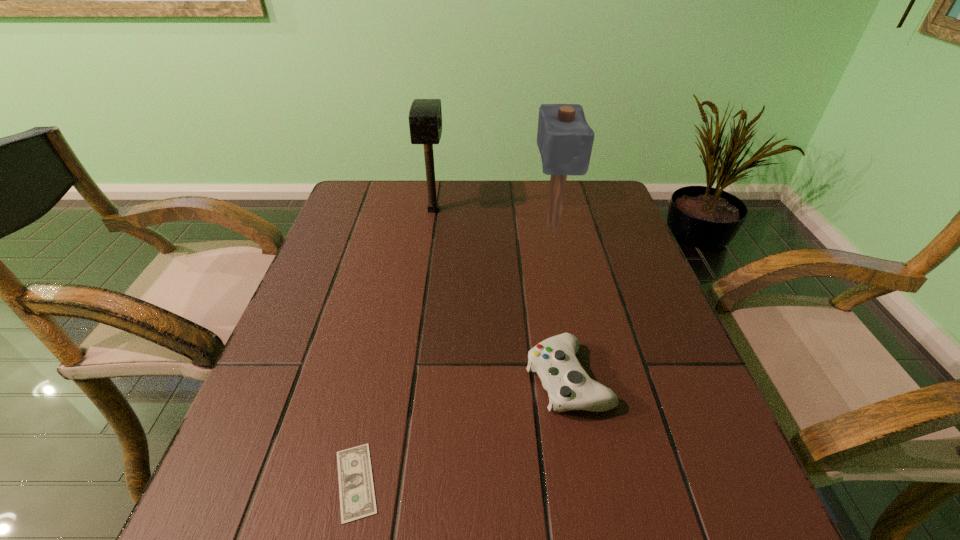
Find the location of a particular element. The image size is (960, 540). object positioned at the near edge is located at coordinates (357, 498).

Find the location of `object located in the right edge section of the desktop`. object located in the right edge section of the desktop is located at coordinates (565, 140).

This screenshot has height=540, width=960. Find the location of `object positioned at the far right corner`. object positioned at the far right corner is located at coordinates (565, 140).

Locate an element on the screen. This screenshot has height=540, width=960. vacant space at the far edge is located at coordinates (537, 186).

Where is `vacant space at the left edge of the desktop`? The width and height of the screenshot is (960, 540). vacant space at the left edge of the desktop is located at coordinates (324, 461).

Locate an element on the screen. The image size is (960, 540). vacant space at the right edge of the desktop is located at coordinates (728, 466).

Find the location of a particular element. free spot at the near left corner of the desktop is located at coordinates point(288,492).

This screenshot has width=960, height=540. I want to click on free space at the far right corner of the desktop, so click(x=609, y=212).

Where is `free spot between the right mallet and the control`? This screenshot has height=540, width=960. free spot between the right mallet and the control is located at coordinates (560, 303).

Image resolution: width=960 pixels, height=540 pixels. I want to click on unoccupied area between the third tallest object and the left mallet, so click(x=500, y=295).